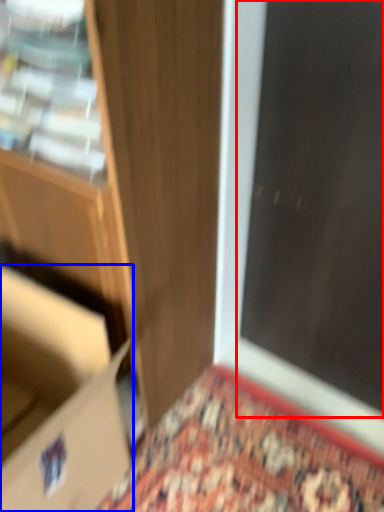
Question: Which of the following is the closest to the observer, screen door (highlighted by a red box) or cardboard box (highlighted by a blue box)?

Choices:
 (A) screen door
 (B) cardboard box

Answer: (B)